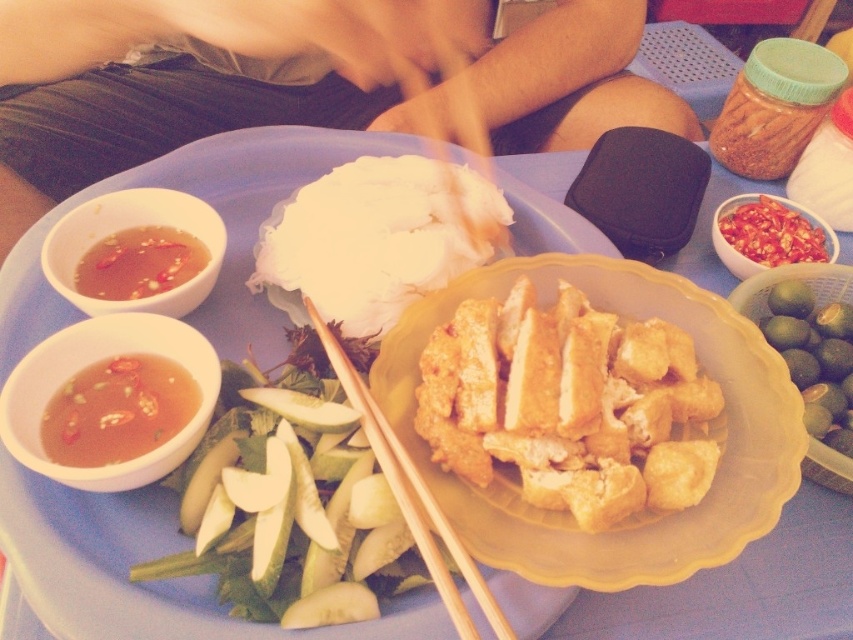
Question: From the image, what is the correct spatial relationship of white fluffy rice at center in relation to translucent gelatinous sauce at upper left?

Choices:
 (A) right
 (B) left

Answer: (A)

Question: Does translucent plastic bowl at upper left appear on the right side of wooden chopsticks at center?

Choices:
 (A) no
 (B) yes

Answer: (A)

Question: Among these points, which one is farthest from the camera?

Choices:
 (A) (751, 320)
 (B) (198, 289)
 (C) (619, 504)

Answer: (A)

Question: Estimate the real-world distances between objects in this image. Which object is closer to the white fluffy rice at center?

Choices:
 (A) red chili flakes at upper right
 (B) yellow plastic plate at center

Answer: (B)

Question: From the image, what is the correct spatial relationship of translucent plastic bowl at upper left in relation to translucent gelatinous sauce at upper left?

Choices:
 (A) right
 (B) left

Answer: (A)

Question: Which of the following is the farthest from the observer?

Choices:
 (A) wooden chopsticks at center
 (B) golden crispy chicken at center

Answer: (B)